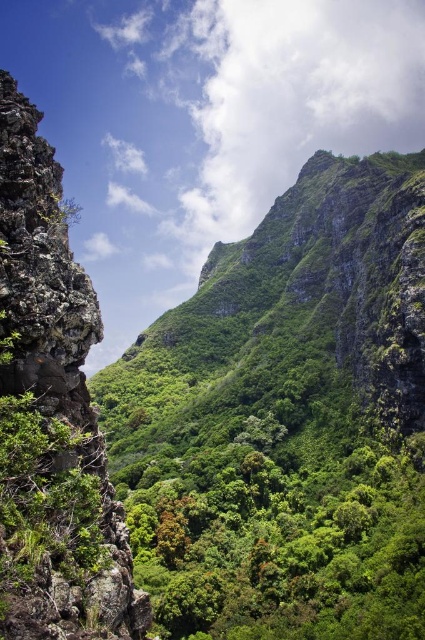
Question: Does rough textured rock at left lie behind green leafy tree at center?

Choices:
 (A) yes
 (B) no

Answer: (B)

Question: Does rough textured rock at left have a greater width compared to green leafy tree at center?

Choices:
 (A) yes
 (B) no

Answer: (B)

Question: Which object is farther from the camera taking this photo?

Choices:
 (A) rough textured rock at left
 (B) green leafy tree at center

Answer: (B)

Question: Does rough textured rock at left have a lesser width compared to green leafy tree at center?

Choices:
 (A) no
 (B) yes

Answer: (B)

Question: Which of the following is the farthest from the observer?

Choices:
 (A) rough textured rock at left
 (B) green leafy tree at center

Answer: (B)

Question: Which object is closer to the camera taking this photo?

Choices:
 (A) green leafy tree at center
 (B) rough textured rock at left

Answer: (B)